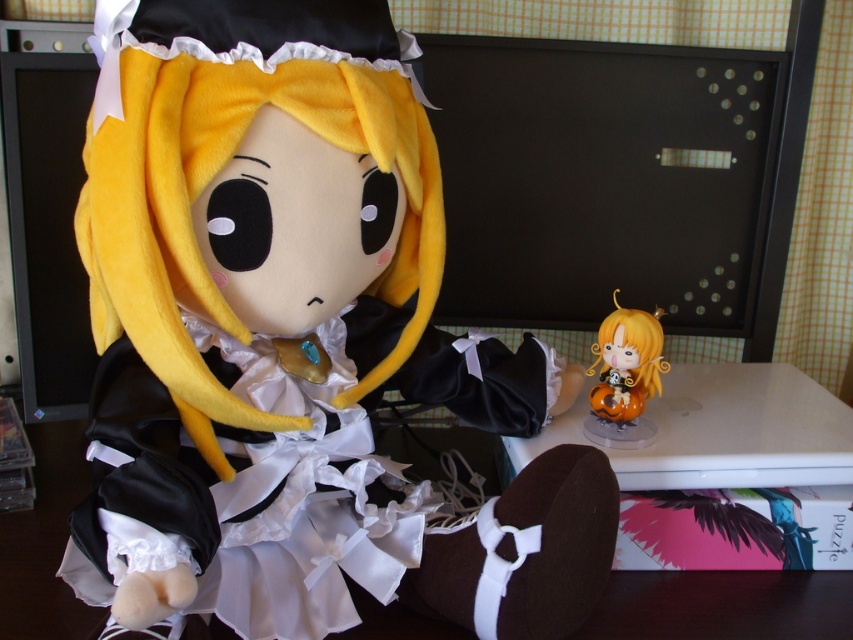
Is soft plush doll at center wider than matte orange figurine at center?

Yes, soft plush doll at center is wider than matte orange figurine at center.

Looking at this image, is soft plush doll at center smaller than matte orange figurine at center?

No.

What do you see at coordinates (294, 339) in the screenshot? I see `soft plush doll at center` at bounding box center [294, 339].

This screenshot has width=853, height=640. In order to click on soft plush doll at center in this screenshot , I will do `click(294, 339)`.

Describe the element at coordinates (294, 339) in the screenshot. This screenshot has width=853, height=640. I see `soft plush doll at center` at that location.

Who is shorter, soft plush doll at center or satin/velvet dress at center?

satin/velvet dress at center is shorter.

What are the coordinates of `soft plush doll at center` in the screenshot? It's located at (294, 339).

The width and height of the screenshot is (853, 640). Find the location of `soft plush doll at center`. soft plush doll at center is located at coordinates (294, 339).

Who is positioned more to the right, satin/velvet dress at center or matte orange figurine at center?

matte orange figurine at center is more to the right.

The image size is (853, 640). Describe the element at coordinates (303, 500) in the screenshot. I see `satin/velvet dress at center` at that location.

Where is `satin/velvet dress at center`? The height and width of the screenshot is (640, 853). satin/velvet dress at center is located at coordinates (303, 500).